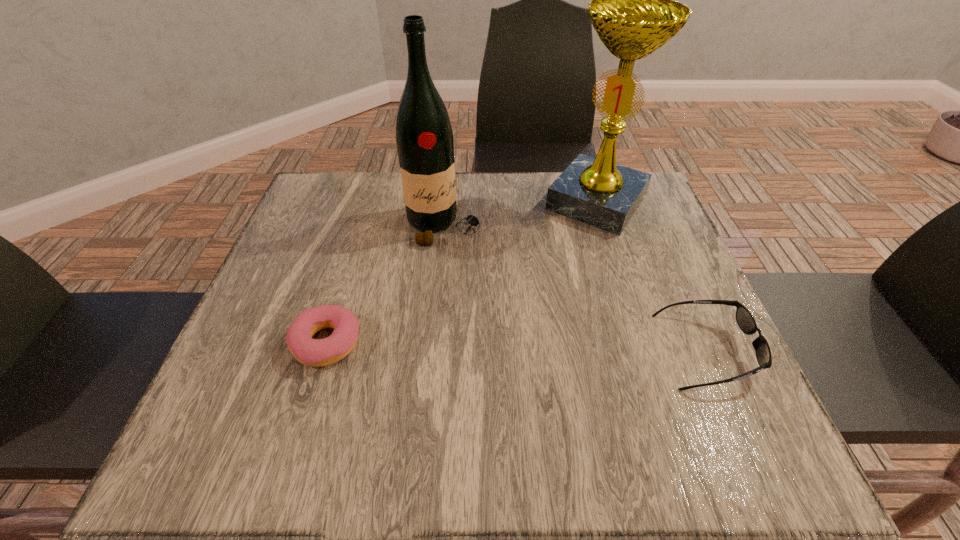
This screenshot has width=960, height=540. I want to click on object that is at the far right corner, so click(634, 11).

Image resolution: width=960 pixels, height=540 pixels. Find the location of `object at the near right corner`. object at the near right corner is located at coordinates (746, 322).

In the image, there is a desktop. Where is `vacant space at the far edge`? vacant space at the far edge is located at coordinates (546, 191).

Identify the location of free space at the near edge. Image resolution: width=960 pixels, height=540 pixels. (580, 411).

You are a GUI agent. You are given a task and a screenshot of the screen. Output one action in this format:
    pyautogui.click(x=<x>, y=<y>)
    Task: Click on the vacant region at the left edge of the desktop
    This screenshot has width=960, height=540.
    Given the screenshot: What is the action you would take?
    pyautogui.click(x=320, y=259)

The image size is (960, 540). Find the location of `vacant point at the right edge`. vacant point at the right edge is located at coordinates (628, 301).

The image size is (960, 540). I want to click on blank space at the far left corner of the desktop, so click(x=348, y=188).

The image size is (960, 540). In order to click on vacant space at the near right corner of the desktop in this screenshot , I will do `click(715, 390)`.

What are the coordinates of `vacant space that's between the shortest object and the award` in the screenshot? It's located at (462, 273).

You are a GUI agent. You are given a task and a screenshot of the screen. Output one action in this format:
    pyautogui.click(x=<x>, y=<y>)
    Task: Click on the vacant point located between the wine bottle and the award
    The image size is (960, 540).
    Given the screenshot: What is the action you would take?
    pyautogui.click(x=519, y=214)